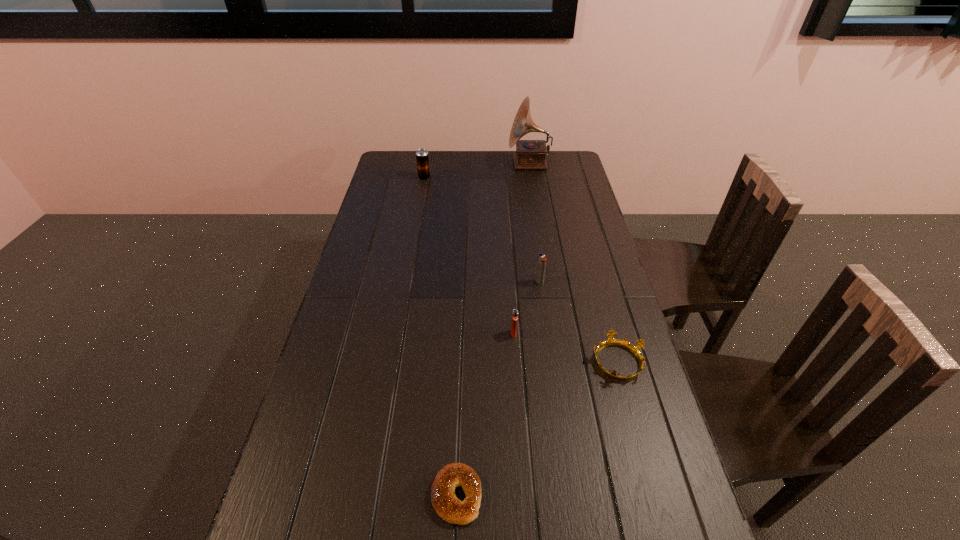
The image size is (960, 540). Find the location of `free space that satisfies the following two spatial constraints: 1. on the horn of the tallest object; 2. on the left side of the crown`. free space that satisfies the following two spatial constraints: 1. on the horn of the tallest object; 2. on the left side of the crown is located at coordinates (562, 361).

Locate an element on the screen. The image size is (960, 540). vacant space that satisfies the following two spatial constraints: 1. on the front side of the third shortest object; 2. on the right side of the crown is located at coordinates (516, 361).

This screenshot has width=960, height=540. In order to click on vacant space that satisfies the following two spatial constraints: 1. on the horn of the phonograph record; 2. on the left side of the crown in this screenshot , I will do `click(562, 361)`.

The image size is (960, 540). I want to click on vacant region that satisfies the following two spatial constraints: 1. on the horn of the tallest object; 2. on the left side of the second shortest object, so click(x=562, y=361).

Where is `free space that satisfies the following two spatial constraints: 1. on the back side of the bagel; 2. on the left side of the fourth tallest object`? Image resolution: width=960 pixels, height=540 pixels. free space that satisfies the following two spatial constraints: 1. on the back side of the bagel; 2. on the left side of the fourth tallest object is located at coordinates (463, 333).